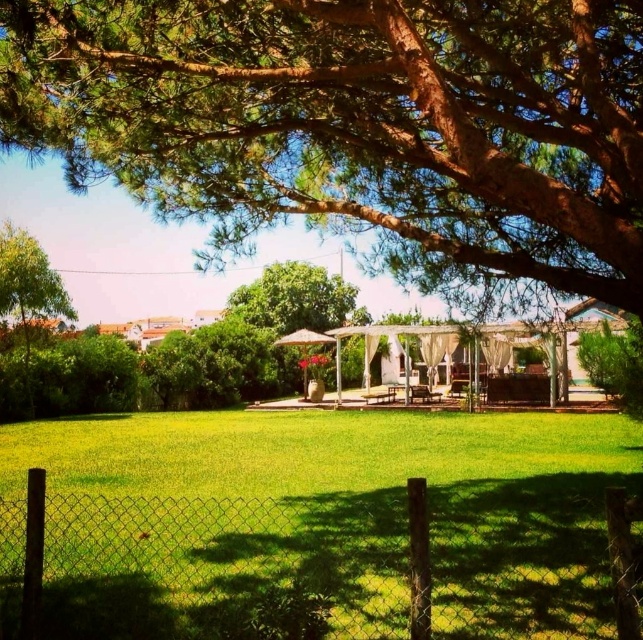
You are planning to install a new fence that is 1.2 meters wide. The existing wire mesh fence at lower center is currently in place. Can the green leafy tree at upper center, which has a trunk width of 0.8 meters, be placed next to the new fence without any obstruction?

The green leafy tree at upper center is thinner than the wire mesh fence at lower center. Since the tree is 0.8 meters wide and the new fence is 1.2 meters wide, there will be enough space between them to avoid obstruction.

You are standing in the backyard and want to take a photo of the green leafy tree at left through the wire mesh fence at lower center. Is the fence blocking your view of the tree?

The wire mesh fence at lower center is in front of the green leafy tree at left, so it will block your view of the tree.

You are standing at the point marked by the coordinates point (356, 124) in the image. Looking around, what large object do you see above you?

The point (356, 124) marks the green leafy tree at upper center, so looking up from that point, you would see the large green leafy tree above you.